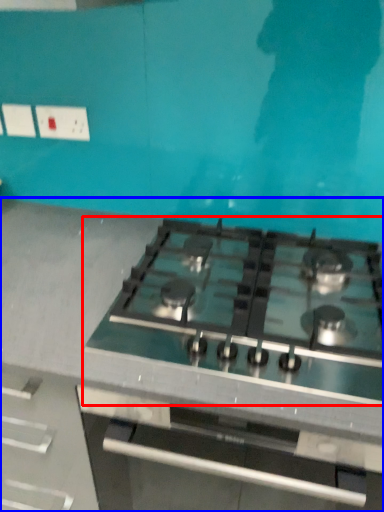
Question: Which object is further to the camera taking this photo, gas stove (highlighted by a red box) or countertop (highlighted by a blue box)?

Choices:
 (A) gas stove
 (B) countertop

Answer: (A)